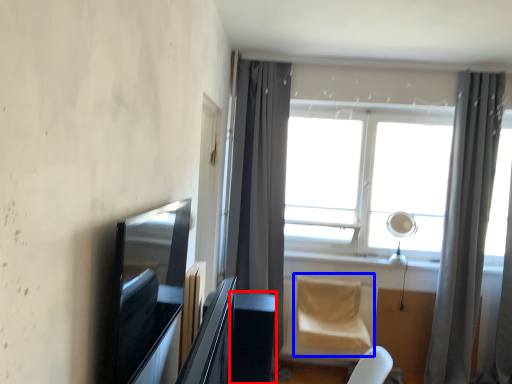
Question: Among these objects, which one is farthest to the camera, table (highlighted by a red box) or swivel chair (highlighted by a blue box)?

Choices:
 (A) table
 (B) swivel chair

Answer: (B)